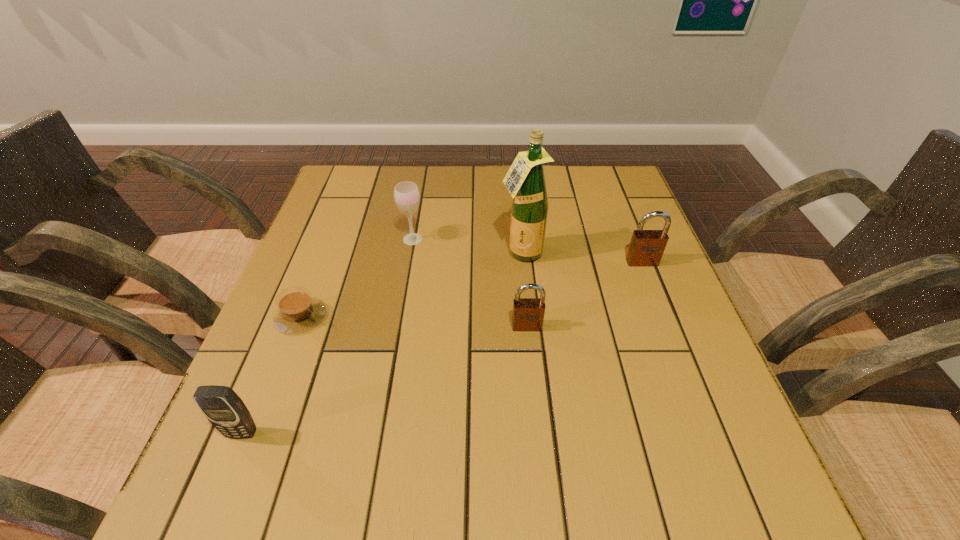
This screenshot has width=960, height=540. I want to click on vacant area at the left edge, so click(337, 231).

The width and height of the screenshot is (960, 540). In order to click on vacant space at the right edge in this screenshot , I will do `click(597, 241)`.

At what (x,y) coordinates should I click in order to perform the action: click on vacant space at the far left corner of the desktop. Please return your answer as a coordinate pair (x, y). The width and height of the screenshot is (960, 540). Looking at the image, I should click on (374, 165).

In the image, there is a desktop. Identify the location of vacant space at the far right corner. The height and width of the screenshot is (540, 960). (610, 165).

The width and height of the screenshot is (960, 540). In order to click on vacant space that's between the liquor and the cappuccino in this screenshot , I will do `click(411, 285)`.

Where is `free space between the right padlock and the cellular telephone`? The height and width of the screenshot is (540, 960). free space between the right padlock and the cellular telephone is located at coordinates (442, 347).

At what (x,y) coordinates should I click in order to perform the action: click on unoccupied area between the cellular telephone and the third object from left to right. Please return your answer as a coordinate pair (x, y). The image size is (960, 540). Looking at the image, I should click on (327, 336).

At what (x,y) coordinates should I click in order to perform the action: click on free space between the right padlock and the nearest object. Please return your answer as a coordinate pair (x, y). Image resolution: width=960 pixels, height=540 pixels. Looking at the image, I should click on (442, 347).

This screenshot has width=960, height=540. What are the coordinates of `unoccupied area between the tallest object and the nearest object` in the screenshot? It's located at (382, 343).

What are the coordinates of `free space between the liquor and the cellular telephone` in the screenshot? It's located at (382, 343).